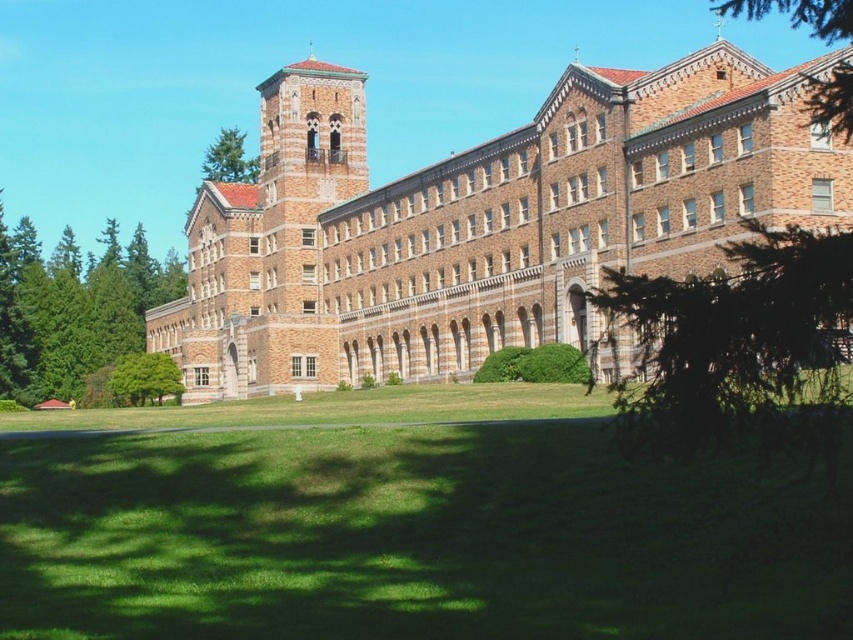
You are standing on the green grass at lower center and want to walk towards the green leafy tree at center. Which direction should you walk to get closer to the tree?

Since the green grass at lower center is closer to the viewer than the green leafy tree at center, you should walk forward towards the tree to get closer to it.